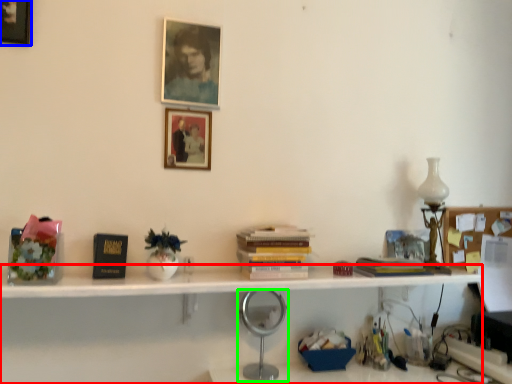
Question: Considering the real-world distances, which object is closest to bookshelf (highlighted by a red box)? picture frame (highlighted by a blue box) or table lamp (highlighted by a green box).

Choices:
 (A) picture frame
 (B) table lamp

Answer: (B)